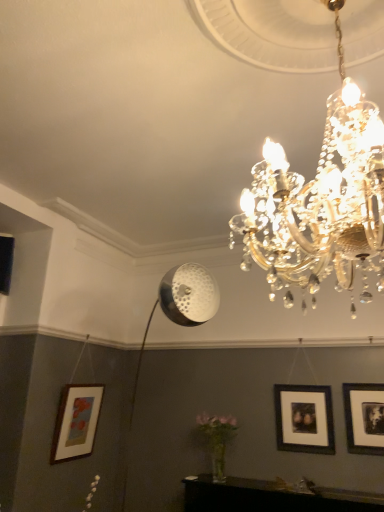
Question: Could wooden matte picture frame at lower left, the 3th picture frame positioned from the right, be considered to be inside black matte picture frame at right, which appears as the first picture frame when viewed from the right?

Choices:
 (A) yes
 (B) no

Answer: (B)

Question: Is black matte picture frame at right, which appears as the first picture frame when viewed from the right, turned away from wooden matte picture frame at lower left, the 3th picture frame positioned from the right?

Choices:
 (A) no
 (B) yes

Answer: (A)

Question: Considering the relative positions of black matte picture frame at right, which appears as the first picture frame when viewed from the right, and wooden matte picture frame at lower left, the first picture frame when ordered from left to right, in the image provided, is black matte picture frame at right, which appears as the first picture frame when viewed from the right, to the right of wooden matte picture frame at lower left, the first picture frame when ordered from left to right, from the viewer's perspective?

Choices:
 (A) no
 (B) yes

Answer: (B)

Question: From the image's perspective, is black matte picture frame at right, which appears as the first picture frame when viewed from the right, below wooden matte picture frame at lower left, the first picture frame when ordered from left to right?

Choices:
 (A) yes
 (B) no

Answer: (B)

Question: Can you confirm if black matte picture frame at right, which appears as the first picture frame when viewed from the right, is smaller than wooden matte picture frame at lower left, the first picture frame when ordered from left to right?

Choices:
 (A) no
 (B) yes

Answer: (B)

Question: From the image's perspective, relative to wooden matte picture frame at lower left, the 3th picture frame positioned from the right, is black matte picture frame at center right, acting as the second picture frame starting from the left, above or below?

Choices:
 (A) below
 (B) above

Answer: (B)

Question: From a real-world perspective, is black matte picture frame at center right, which appears as the second picture frame when viewed from the right, above or below wooden matte picture frame at lower left, the first picture frame when ordered from left to right?

Choices:
 (A) below
 (B) above

Answer: (B)

Question: In terms of height, does black matte picture frame at center right, acting as the second picture frame starting from the left, look taller or shorter compared to wooden matte picture frame at lower left, the 3th picture frame positioned from the right?

Choices:
 (A) short
 (B) tall

Answer: (A)

Question: Considering the positions of point (326, 445) and point (56, 459), is point (326, 445) closer or farther from the camera than point (56, 459)?

Choices:
 (A) closer
 (B) farther

Answer: (A)

Question: From the image's perspective, relative to black matte picture frame at right, which appears as the first picture frame when viewed from the right, is black matte picture frame at center right, acting as the second picture frame starting from the left, above or below?

Choices:
 (A) above
 (B) below

Answer: (B)

Question: Considering the positions of black matte picture frame at center right, acting as the second picture frame starting from the left, and black matte picture frame at right, positioned as the 3th picture frame in left-to-right order, in the image, is black matte picture frame at center right, acting as the second picture frame starting from the left, wider or thinner than black matte picture frame at right, positioned as the 3th picture frame in left-to-right order,?

Choices:
 (A) wide
 (B) thin

Answer: (B)

Question: Which is correct: black matte picture frame at center right, which appears as the second picture frame when viewed from the right, is inside black matte picture frame at right, positioned as the 3th picture frame in left-to-right order, or outside of it?

Choices:
 (A) inside
 (B) outside

Answer: (B)

Question: In terms of height, does black matte picture frame at center right, acting as the second picture frame starting from the left, look taller or shorter compared to black matte picture frame at right, which appears as the first picture frame when viewed from the right?

Choices:
 (A) short
 (B) tall

Answer: (B)

Question: Is point (354, 433) closer or farther from the camera than point (69, 458)?

Choices:
 (A) farther
 (B) closer

Answer: (B)

Question: From a real-world perspective, is black matte picture frame at right, which appears as the first picture frame when viewed from the right, positioned above or below wooden matte picture frame at lower left, the first picture frame when ordered from left to right?

Choices:
 (A) below
 (B) above

Answer: (B)